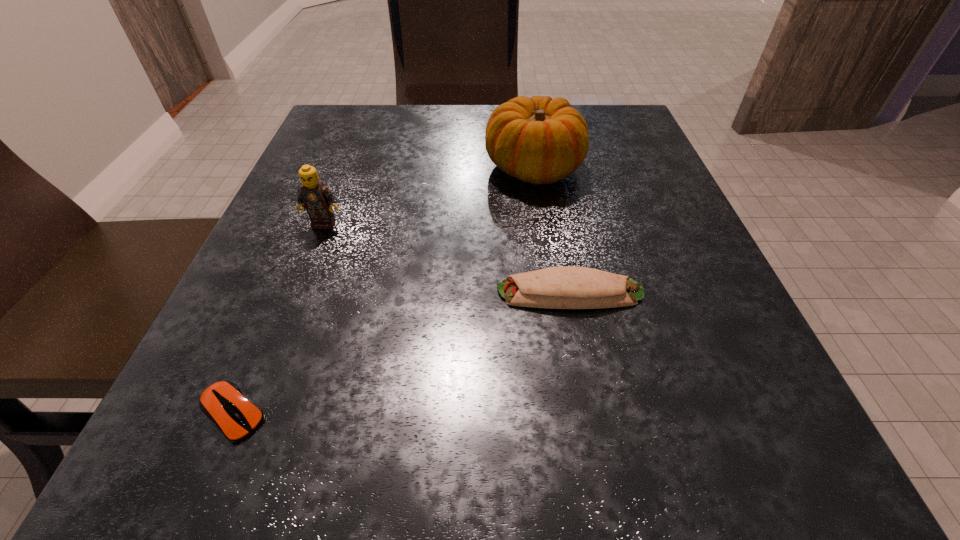
You are a GUI agent. You are given a task and a screenshot of the screen. Output one action in this format:
    pyautogui.click(x=<x>, y=<y>)
    Task: Click on the gourd
    The width and height of the screenshot is (960, 540).
    Given the screenshot: What is the action you would take?
    pyautogui.click(x=539, y=140)

The height and width of the screenshot is (540, 960). I want to click on the third nearest object, so click(315, 197).

Where is `the third farthest object`? The height and width of the screenshot is (540, 960). the third farthest object is located at coordinates point(567,287).

You are a GUI agent. You are given a task and a screenshot of the screen. Output one action in this format:
    pyautogui.click(x=<x>, y=<y>)
    Task: Click on the burrito
    The image size is (960, 540).
    Given the screenshot: What is the action you would take?
    pyautogui.click(x=567, y=287)

The image size is (960, 540). Identify the location of the nearest object. (224, 403).

At what (x,y) coordinates should I click in order to perform the action: click on the shortest object. Please return your answer as a coordinate pair (x, y). The width and height of the screenshot is (960, 540). Looking at the image, I should click on (224, 403).

Where is `vacant space located 0.100m on the back of the gourd`? This screenshot has width=960, height=540. vacant space located 0.100m on the back of the gourd is located at coordinates (527, 120).

Locate an element on the screen. This screenshot has width=960, height=540. vacant space situated 0.070m in front of the third nearest object is located at coordinates (311, 258).

Image resolution: width=960 pixels, height=540 pixels. Find the location of `vacant position located at the bitten end of the third farthest object`. vacant position located at the bitten end of the third farthest object is located at coordinates (324, 293).

This screenshot has height=540, width=960. Identify the location of vacant area located 0.160m at the bitten end of the third farthest object. (386, 293).